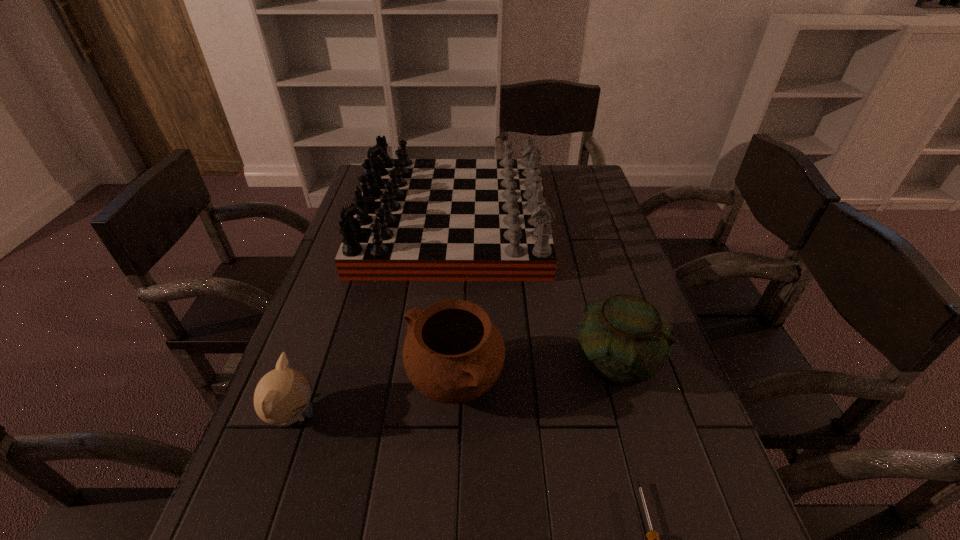
Identify the location of free area in between the right pottery and the left pottery. (536, 373).

Point out which object is positioned as the second nearest to the fourth tallest object. Please provide its 2D coordinates. Your answer should be formatted as a tuple, i.e. [(x, y)], where the tuple contains the x and y coordinates of a point satisfying the conditions above.

[(416, 219)]

Choose which object is the second nearest neighbor to the gameboard. Please provide its 2D coordinates. Your answer should be formatted as a tuple, i.e. [(x, y)], where the tuple contains the x and y coordinates of a point satisfying the conditions above.

[(453, 353)]

Locate an element on the screen. vacant position in the image that satisfies the following two spatial constraints: 1. on the front side of the right pottery; 2. on the face of the fourth tallest object is located at coordinates (631, 416).

You are a GUI agent. You are given a task and a screenshot of the screen. Output one action in this format:
    pyautogui.click(x=<x>, y=<y>)
    Task: Click on the free space that satisfies the following two spatial constraints: 1. on the back side of the left pottery; 2. on the right side of the right pottery
    The height and width of the screenshot is (540, 960).
    Given the screenshot: What is the action you would take?
    pyautogui.click(x=456, y=362)

At what (x,y) coordinates should I click in order to perform the action: click on vacant area in the image that satisfies the following two spatial constraints: 1. on the front side of the farthest object; 2. on the face of the fourth tallest object. Please return your answer as a coordinate pair (x, y). This screenshot has width=960, height=540. Looking at the image, I should click on 437,416.